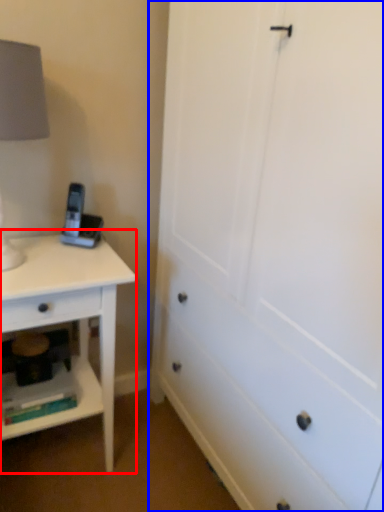
Question: Among these objects, which one is farthest to the camera, nightstand (highlighted by a red box) or chest of drawers (highlighted by a blue box)?

Choices:
 (A) nightstand
 (B) chest of drawers

Answer: (A)